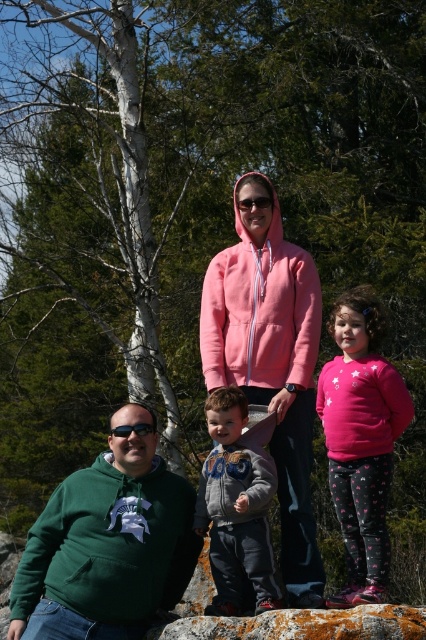
You are standing in front of the family photo. There are two points marked in the image. The first point is at coordinate point (365,404) and the second point is at coordinate point (408,632). Which point is closer to you?

Point (365,404) is closer to you than point (408,632) because it is further to the viewer.

You are a photographer trying to capture a photo of the family. You notice two points in the image at coordinates point [224,330] and point [135,426]. Which point is closer to your camera?

Point [135,426] is closer to the camera than point [224,330].